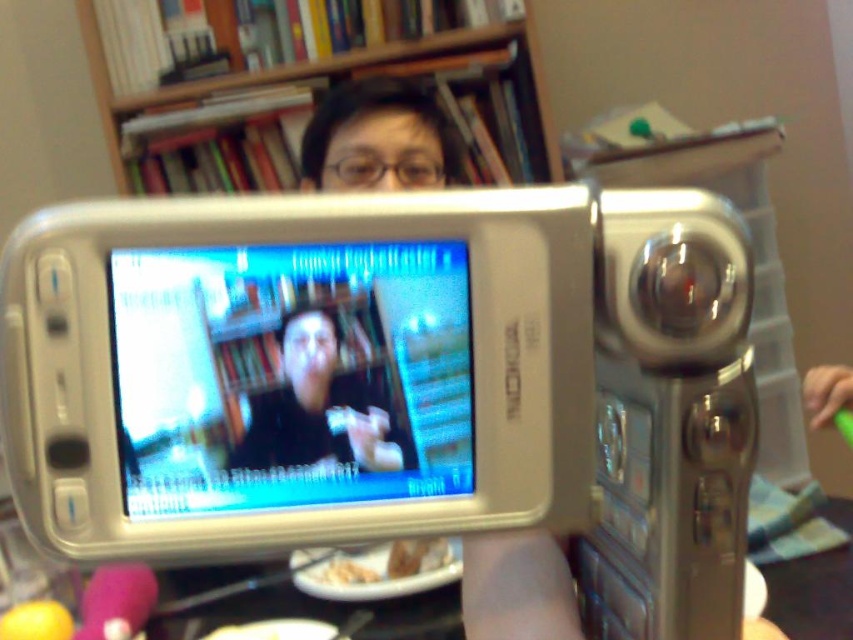
What is located at the coordinates point (374, 369) in the image?

The point (374, 369) indicates the silver metallic camera at center.

You are setting up a photo shoot in the room. You need to place the silver metallic camera at center so that it is visible from the doorway. The wooden bookshelf at upper center might block the view. Is the camera visible from the doorway?

The silver metallic camera at center is not as tall as the wooden bookshelf at upper center, so the camera might be partially or fully blocked by the bookshelf depending on their positions. However, since the camera is at center and the bookshelf is at upper center, the camera could still be visible if placed lower than the bookshelf.

You are a photographer trying to capture the shiny silver phone at center and the black matte shirt at center in a single frame. Based on their positions, which object is closer to the camera?

The shiny silver phone at center is located above the black matte shirt at center, so it is closer to the camera.